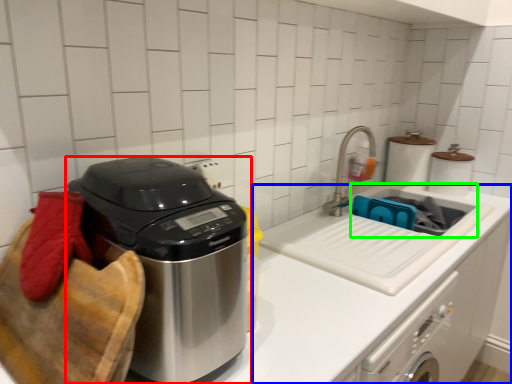
Question: Considering the real-world distances, which object is farthest from home appliance (highlighted by a red box)? counter (highlighted by a blue box) or sink (highlighted by a green box)?

Choices:
 (A) counter
 (B) sink

Answer: (B)